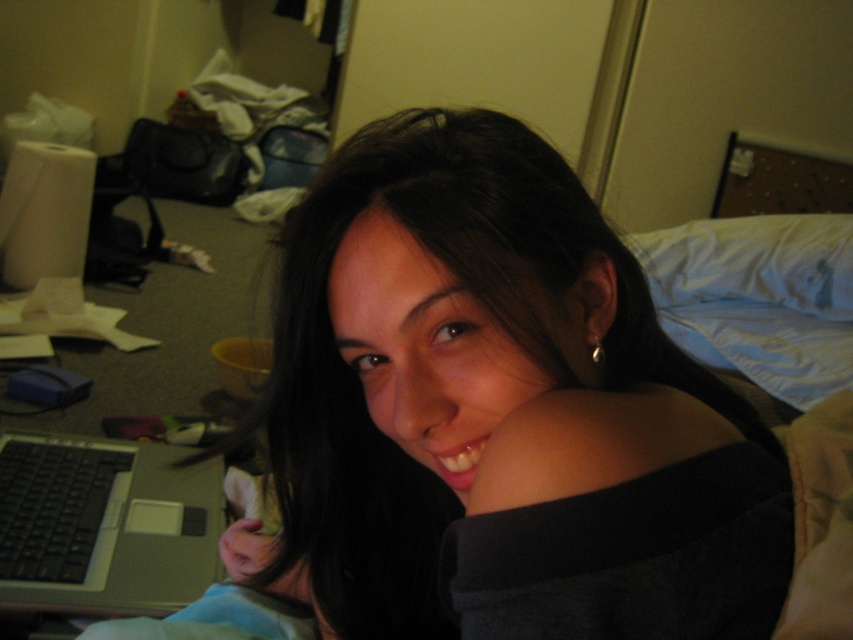
Is point (21, 552) positioned behind point (630, 250)?

That is False.

Looking at this image, is silver metallic laptop at lower left shorter than white soft pillow at upper right?

Indeed, silver metallic laptop at lower left has a lesser height compared to white soft pillow at upper right.

Describe the element at coordinates (103, 525) in the screenshot. The height and width of the screenshot is (640, 853). I see `silver metallic laptop at lower left` at that location.

Image resolution: width=853 pixels, height=640 pixels. Find the location of `silver metallic laptop at lower left`. silver metallic laptop at lower left is located at coordinates (103, 525).

Which is more to the left, matte black hair at center or silver metallic laptop at lower left?

silver metallic laptop at lower left is more to the left.

Is matte black hair at center to the left of silver metallic laptop at lower left from the viewer's perspective?

No, matte black hair at center is not to the left of silver metallic laptop at lower left.

Is point (711, 584) closer to viewer compared to point (122, 541)?

Yes, point (711, 584) is in front of point (122, 541).

Find the location of a particular element. matte black hair at center is located at coordinates (498, 413).

Which is in front, point (428, 324) or point (761, 234)?

Positioned in front is point (428, 324).

Can you confirm if matte black hair at center is shorter than white soft pillow at upper right?

In fact, matte black hair at center may be taller than white soft pillow at upper right.

What do you see at coordinates (498, 413) in the screenshot? The width and height of the screenshot is (853, 640). I see `matte black hair at center` at bounding box center [498, 413].

Where is `matte black hair at center`? Image resolution: width=853 pixels, height=640 pixels. matte black hair at center is located at coordinates (498, 413).